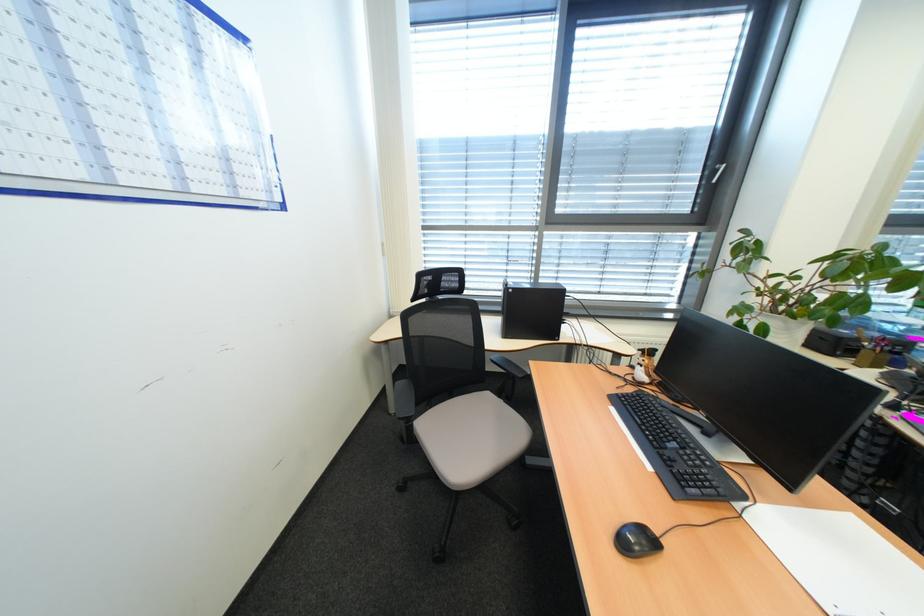
Find where to lift the black computer tower. Please return your answer as a coordinate pair (x, y).

(764, 395)